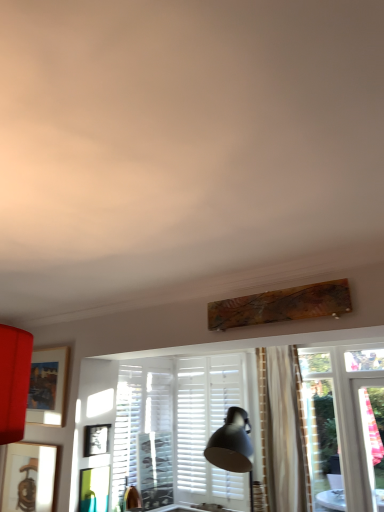
This screenshot has height=512, width=384. Describe the element at coordinates (96, 439) in the screenshot. I see `matte black picture frame at center, marked as the 2th picture frame in a bottom-to-top arrangement` at that location.

The image size is (384, 512). What do you see at coordinates (47, 386) in the screenshot?
I see `matte wooden picture frame at left, the third picture frame ordered from the bottom` at bounding box center [47, 386].

This screenshot has width=384, height=512. What are the coordinates of `wooden picture frame at lower left, which appears as the third picture frame when viewed from the top` in the screenshot? It's located at (29, 477).

How different are the orientations of wooden picture frame at lower left, which appears as the third picture frame when viewed from the top, and matte black picture frame at center, which is counted as the second picture frame, starting from the top, in degrees?

wooden picture frame at lower left, which appears as the third picture frame when viewed from the top, and matte black picture frame at center, which is counted as the second picture frame, starting from the top, are facing 89.7 degrees away from each other.

Considering the positions of objects wooden picture frame at lower left, which is the 1th picture frame from bottom to top, and matte black picture frame at center, which is counted as the second picture frame, starting from the top, in the image provided, who is more to the left, wooden picture frame at lower left, which is the 1th picture frame from bottom to top, or matte black picture frame at center, which is counted as the second picture frame, starting from the top,?

Positioned to the left is wooden picture frame at lower left, which is the 1th picture frame from bottom to top.

In terms of width, does wooden picture frame at lower left, which is the 1th picture frame from bottom to top, look wider or thinner when compared to matte black picture frame at center, marked as the 2th picture frame in a bottom-to-top arrangement?

wooden picture frame at lower left, which is the 1th picture frame from bottom to top, is thinner than matte black picture frame at center, marked as the 2th picture frame in a bottom-to-top arrangement.

Is matte black picture frame at center, which is counted as the second picture frame, starting from the top, at the back of wooden picture frame at lower left, which is the 1th picture frame from bottom to top?

No.

Is white matte shutter at center not near matte black picture frame at center, marked as the 2th picture frame in a bottom-to-top arrangement?

No.

How many degrees apart are the facing directions of white matte shutter at center and matte black picture frame at center, marked as the 2th picture frame in a bottom-to-top arrangement?

The facing directions of white matte shutter at center and matte black picture frame at center, marked as the 2th picture frame in a bottom-to-top arrangement, are 0.00233 degrees apart.

Which is behind, white matte shutter at center or matte black picture frame at center, marked as the 2th picture frame in a bottom-to-top arrangement?

white matte shutter at center is more distant.

Locate an element on the screen. The width and height of the screenshot is (384, 512). shutter on the right of matte black picture frame at center, which is counted as the second picture frame, starting from the top is located at coordinates (141, 428).

In terms of size, does matte black picture frame at center, which is counted as the second picture frame, starting from the top, appear bigger or smaller than matte wooden picture frame at left, which ranks as the 1th picture frame in top-to-bottom order?

matte black picture frame at center, which is counted as the second picture frame, starting from the top, is smaller than matte wooden picture frame at left, which ranks as the 1th picture frame in top-to-bottom order.

From a real-world perspective, does matte black picture frame at center, marked as the 2th picture frame in a bottom-to-top arrangement, sit lower than matte wooden picture frame at left, which ranks as the 1th picture frame in top-to-bottom order?

Yes.

Based on the photo, can you tell me how much matte black picture frame at center, which is counted as the second picture frame, starting from the top, and matte wooden picture frame at left, the third picture frame ordered from the bottom, differ in facing direction?

89.7 degrees.

Measure the distance from matte black picture frame at center, marked as the 2th picture frame in a bottom-to-top arrangement, to matte wooden picture frame at left, the third picture frame ordered from the bottom.

A distance of 20.71 inches exists between matte black picture frame at center, marked as the 2th picture frame in a bottom-to-top arrangement, and matte wooden picture frame at left, the third picture frame ordered from the bottom.

From the image's perspective, is matte wooden picture frame at left, which ranks as the 1th picture frame in top-to-bottom order, located above or below white matte shutter at center?

matte wooden picture frame at left, which ranks as the 1th picture frame in top-to-bottom order, is above white matte shutter at center.

In the scene shown: Considering the sizes of objects matte wooden picture frame at left, the third picture frame ordered from the bottom, and white matte shutter at center in the image provided, who is taller, matte wooden picture frame at left, the third picture frame ordered from the bottom, or white matte shutter at center?

With more height is white matte shutter at center.

Which object is thinner, matte wooden picture frame at left, which ranks as the 1th picture frame in top-to-bottom order, or white matte shutter at center?

With smaller width is matte wooden picture frame at left, which ranks as the 1th picture frame in top-to-bottom order.

Locate an element on the screen. This screenshot has width=384, height=512. shutter located underneath the matte wooden picture frame at left, which ranks as the 1th picture frame in top-to-bottom order (from a real-world perspective) is located at coordinates pos(141,428).

Does point (53, 385) come closer to viewer compared to point (35, 485)?

No, it is not.

Measure the distance between matte wooden picture frame at left, the third picture frame ordered from the bottom, and wooden picture frame at lower left, which is the 1th picture frame from bottom to top.

matte wooden picture frame at left, the third picture frame ordered from the bottom, and wooden picture frame at lower left, which is the 1th picture frame from bottom to top, are 18.97 inches apart.

Is matte wooden picture frame at left, the third picture frame ordered from the bottom, shorter than wooden picture frame at lower left, which appears as the third picture frame when viewed from the top?

No, matte wooden picture frame at left, the third picture frame ordered from the bottom, is not shorter than wooden picture frame at lower left, which appears as the third picture frame when viewed from the top.

In the image, is matte wooden picture frame at left, which ranks as the 1th picture frame in top-to-bottom order, positioned in front of or behind wooden picture frame at lower left, which is the 1th picture frame from bottom to top?

In the image, matte wooden picture frame at left, which ranks as the 1th picture frame in top-to-bottom order, appears behind wooden picture frame at lower left, which is the 1th picture frame from bottom to top.

At what (x,y) coordinates should I click in order to perform the action: click on picture frame above the white matte shutter at center (from a real-world perspective). Please return your answer as a coordinate pair (x, y). This screenshot has width=384, height=512. Looking at the image, I should click on (47, 386).

Considering the relative sizes of white matte shutter at center and matte wooden picture frame at left, the third picture frame ordered from the bottom, in the image provided, is white matte shutter at center wider than matte wooden picture frame at left, the third picture frame ordered from the bottom,?

Yes.

Measure the distance between white matte shutter at center and matte wooden picture frame at left, the third picture frame ordered from the bottom.

white matte shutter at center and matte wooden picture frame at left, the third picture frame ordered from the bottom, are 33.44 inches apart.

From their relative heights in the image, would you say white matte shutter at center is taller or shorter than wooden picture frame at lower left, which appears as the third picture frame when viewed from the top?

In the image, white matte shutter at center appears to be taller than wooden picture frame at lower left, which appears as the third picture frame when viewed from the top.

Considering the sizes of objects white matte shutter at center and wooden picture frame at lower left, which appears as the third picture frame when viewed from the top, in the image provided, who is wider, white matte shutter at center or wooden picture frame at lower left, which appears as the third picture frame when viewed from the top,?

Wider between the two is white matte shutter at center.

Is white matte shutter at center next to wooden picture frame at lower left, which is the 1th picture frame from bottom to top?

white matte shutter at center is not next to wooden picture frame at lower left, which is the 1th picture frame from bottom to top, and they're not touching.

Image resolution: width=384 pixels, height=512 pixels. Find the location of `picture frame below the white matte shutter at center (from the image's perspective)`. picture frame below the white matte shutter at center (from the image's perspective) is located at coordinates (29, 477).

Where is `picture frame that is the 2nd one when counting leftward from the matte black picture frame at center, marked as the 2th picture frame in a bottom-to-top arrangement`? This screenshot has width=384, height=512. picture frame that is the 2nd one when counting leftward from the matte black picture frame at center, marked as the 2th picture frame in a bottom-to-top arrangement is located at coordinates 29,477.

Find the location of a particular element. This screenshot has width=384, height=512. shutter located above the matte black picture frame at center, which is counted as the second picture frame, starting from the top (from a real-world perspective) is located at coordinates (141, 428).

Considering their positions, is matte wooden picture frame at left, the third picture frame ordered from the bottom, positioned further to wooden picture frame at lower left, which appears as the third picture frame when viewed from the top, than white matte shutter at center?

The object further to wooden picture frame at lower left, which appears as the third picture frame when viewed from the top, is white matte shutter at center.

Looking at the image, which one is located further to white matte shutter at center, matte wooden picture frame at left, the third picture frame ordered from the bottom, or wooden picture frame at lower left, which is the 1th picture frame from bottom to top?

Based on the image, wooden picture frame at lower left, which is the 1th picture frame from bottom to top, appears to be further to white matte shutter at center.

Which object lies nearer to the anchor point matte wooden picture frame at left, the third picture frame ordered from the bottom, matte black picture frame at center, marked as the 2th picture frame in a bottom-to-top arrangement, or wooden picture frame at lower left, which appears as the third picture frame when viewed from the top?

wooden picture frame at lower left, which appears as the third picture frame when viewed from the top, is positioned closer to the anchor matte wooden picture frame at left, the third picture frame ordered from the bottom.

Considering their positions, is matte wooden picture frame at left, the third picture frame ordered from the bottom, positioned closer to white matte shutter at center than matte black picture frame at center, marked as the 2th picture frame in a bottom-to-top arrangement?

matte black picture frame at center, marked as the 2th picture frame in a bottom-to-top arrangement.

From the image, which object appears to be nearer to wooden picture frame at lower left, which appears as the third picture frame when viewed from the top, matte black picture frame at center, marked as the 2th picture frame in a bottom-to-top arrangement, or matte wooden picture frame at left, which ranks as the 1th picture frame in top-to-bottom order?

The object closer to wooden picture frame at lower left, which appears as the third picture frame when viewed from the top, is matte wooden picture frame at left, which ranks as the 1th picture frame in top-to-bottom order.

Looking at the image, which one is located further to matte black picture frame at center, marked as the 2th picture frame in a bottom-to-top arrangement, wooden picture frame at lower left, which is the 1th picture frame from bottom to top, or matte wooden picture frame at left, the third picture frame ordered from the bottom?

wooden picture frame at lower left, which is the 1th picture frame from bottom to top.

Considering their positions, is wooden picture frame at lower left, which is the 1th picture frame from bottom to top, positioned further to matte wooden picture frame at left, the third picture frame ordered from the bottom, than matte black picture frame at center, marked as the 2th picture frame in a bottom-to-top arrangement?

matte black picture frame at center, marked as the 2th picture frame in a bottom-to-top arrangement, is further to matte wooden picture frame at left, the third picture frame ordered from the bottom.

Estimate the real-world distances between objects in this image. Which object is closer to matte black picture frame at center, marked as the 2th picture frame in a bottom-to-top arrangement, white matte shutter at center or matte wooden picture frame at left, the third picture frame ordered from the bottom?

The object closer to matte black picture frame at center, marked as the 2th picture frame in a bottom-to-top arrangement, is matte wooden picture frame at left, the third picture frame ordered from the bottom.

This screenshot has width=384, height=512. I want to click on picture frame between matte wooden picture frame at left, the third picture frame ordered from the bottom, and wooden picture frame at lower left, which is the 1th picture frame from bottom to top, from top to bottom, so click(x=96, y=439).

I want to click on picture frame between matte wooden picture frame at left, which ranks as the 1th picture frame in top-to-bottom order, and white matte shutter at center, so click(x=96, y=439).